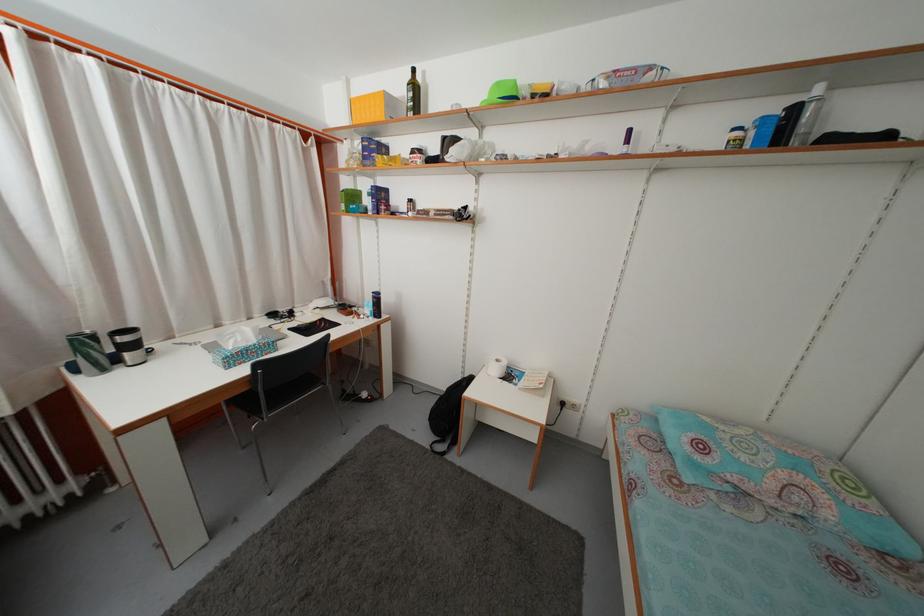
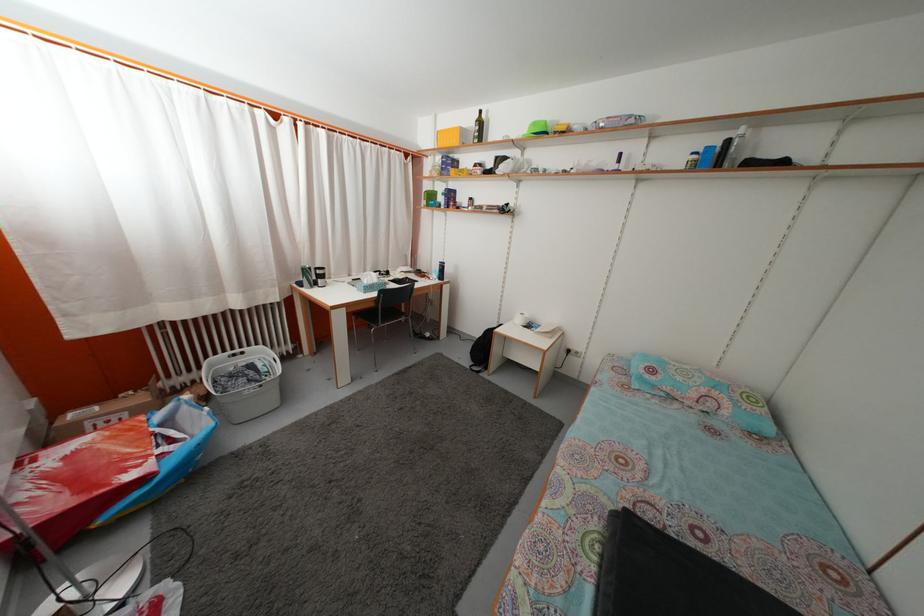
Find the pixel in the second image that matches point 99,344 in the first image.

(315, 276)